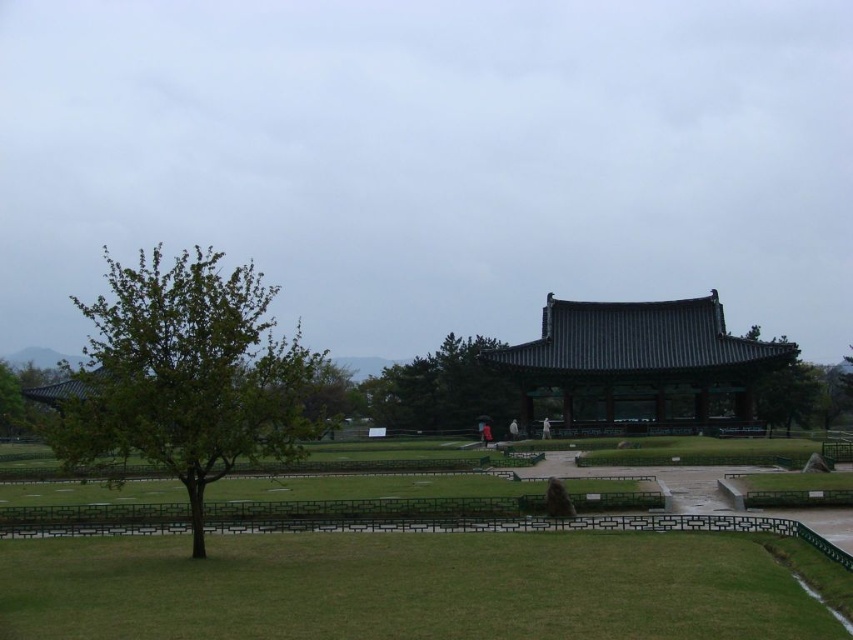
Is green grass at center to the right of green leafy tree at left from the viewer's perspective?

Yes, green grass at center is to the right of green leafy tree at left.

Is the position of green grass at center more distant than that of green leafy tree at left?

No, it is not.

You are a GUI agent. You are given a task and a screenshot of the screen. Output one action in this format:
    pyautogui.click(x=<x>, y=<y>)
    Task: Click on the green grass at center
    The image size is (853, 640).
    Given the screenshot: What is the action you would take?
    pyautogui.click(x=405, y=588)

Where is `green grass at center`? green grass at center is located at coordinates (405, 588).

Is point (173, 456) positioned in front of point (650, 381)?

Yes, it is in front of point (650, 381).

The image size is (853, 640). What do you see at coordinates (187, 376) in the screenshot? I see `green leafy tree at left` at bounding box center [187, 376].

The width and height of the screenshot is (853, 640). What are the coordinates of `green leafy tree at left` in the screenshot? It's located at click(187, 376).

Does green leafy tree at left have a lesser height compared to green leafy tree at center?

Incorrect, green leafy tree at left's height does not fall short of green leafy tree at center's.

Can you confirm if green leafy tree at left is thinner than green leafy tree at center?

In fact, green leafy tree at left might be wider than green leafy tree at center.

What do you see at coordinates (187, 376) in the screenshot?
I see `green leafy tree at left` at bounding box center [187, 376].

The image size is (853, 640). Identify the location of green leafy tree at left. (187, 376).